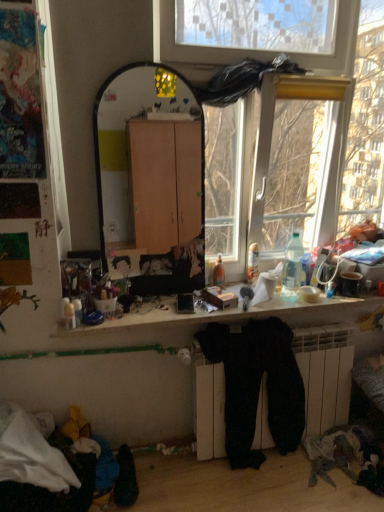
The width and height of the screenshot is (384, 512). Describe the element at coordinates (240, 314) in the screenshot. I see `wooden desk at center` at that location.

The height and width of the screenshot is (512, 384). What do you see at coordinates (257, 385) in the screenshot?
I see `black velvet pants at lower center` at bounding box center [257, 385].

What is the approximate height of clear plastic bottle at right?

The height of clear plastic bottle at right is 13.28 inches.

Locate an element on the screen. wooden desk at center is located at coordinates (240, 314).

From the image's perspective, which one is positioned lower, clear plastic bottle at right or wooden desk at center?

wooden desk at center is shown below in the image.

Between clear plastic bottle at right and wooden desk at center, which one has smaller width?

clear plastic bottle at right.

Is point (299, 279) less distant than point (148, 317)?

That is False.

Considering the relative positions of clear plastic bottle at right and wooden desk at center in the image provided, is clear plastic bottle at right in front of wooden desk at center?

No.

From the image's perspective, which is above, smooth plastic figurine at center, which ranks as the second person in right-to-left order, or silky black fabric at center, the 2th person in the left-to-right sequence?

smooth plastic figurine at center, which ranks as the second person in right-to-left order, from the image's perspective.

Is smooth plastic figurine at center, which ranks as the second person in right-to-left order, wider than silky black fabric at center, which is the first person in right-to-left order?

Yes, smooth plastic figurine at center, which ranks as the second person in right-to-left order, is wider than silky black fabric at center, which is the first person in right-to-left order.

Which object is positioned more to the left, wooden desk at center or silky black fabric at center, the 2th person in the left-to-right sequence?

silky black fabric at center, the 2th person in the left-to-right sequence, is more to the left.

How far apart are wooden desk at center and silky black fabric at center, the 2th person in the left-to-right sequence?

wooden desk at center is 15.70 inches away from silky black fabric at center, the 2th person in the left-to-right sequence.

Locate an element on the screen. computer desk located underneath the silky black fabric at center, which is the first person in right-to-left order (from a real-world perspective) is located at coordinates [x=240, y=314].

Is wooden desk at center positioned with its back to silky black fabric at center, which is the first person in right-to-left order?

That's not correct — wooden desk at center is not looking away from silky black fabric at center, which is the first person in right-to-left order.

In the image, is smooth plastic figurine at center, which ranks as the second person in right-to-left order, positioned in front of or behind clear plastic bottle at right?

In the image, smooth plastic figurine at center, which ranks as the second person in right-to-left order, appears behind clear plastic bottle at right.

Between smooth plastic figurine at center, which ranks as the second person in right-to-left order, and clear plastic bottle at right, which one has smaller size?

Smaller between the two is smooth plastic figurine at center, which ranks as the second person in right-to-left order.

Can you tell me how much smooth plastic figurine at center, which is counted as the 1th person, starting from the left, and clear plastic bottle at right differ in facing direction?

There is a 6.5-degree angle between the facing directions of smooth plastic figurine at center, which is counted as the 1th person, starting from the left, and clear plastic bottle at right.

In the scene shown: Is smooth plastic figurine at center, which is counted as the 1th person, starting from the left, completely or partially outside of clear plastic bottle at right?

Yes, smooth plastic figurine at center, which is counted as the 1th person, starting from the left, is outside of clear plastic bottle at right.

Is clear plastic bottle at right positioned beyond the bounds of smooth plastic figurine at center, which ranks as the second person in right-to-left order?

Yes, clear plastic bottle at right is located beyond the bounds of smooth plastic figurine at center, which ranks as the second person in right-to-left order.

Which is more to the left, clear plastic bottle at right or smooth plastic figurine at center, which ranks as the second person in right-to-left order?

From the viewer's perspective, smooth plastic figurine at center, which ranks as the second person in right-to-left order, appears more on the left side.

Can you tell me how much clear plastic bottle at right and smooth plastic figurine at center, which ranks as the second person in right-to-left order, differ in facing direction?

The angle between the facing direction of clear plastic bottle at right and the facing direction of smooth plastic figurine at center, which ranks as the second person in right-to-left order, is 6.5 degrees.

Can you confirm if clear plastic bottle at right is thinner than smooth plastic figurine at center, which is counted as the 1th person, starting from the left?

Incorrect, the width of clear plastic bottle at right is not less than that of smooth plastic figurine at center, which is counted as the 1th person, starting from the left.

Looking at their sizes, would you say black velvet pants at lower center is wider or thinner than clear plastic bottle at right?

Considering their sizes, black velvet pants at lower center looks broader than clear plastic bottle at right.

Is there a large distance between black velvet pants at lower center and clear plastic bottle at right?

No.

How different are the orientations of black velvet pants at lower center and clear plastic bottle at right in degrees?

The angle between the facing direction of black velvet pants at lower center and the facing direction of clear plastic bottle at right is 1.23 degrees.

Is black velvet pants at lower center turned away from clear plastic bottle at right?

No, clear plastic bottle at right is not at the back of black velvet pants at lower center.

Which is more to the right, black velvet pants at lower center or smooth plastic figurine at center, which is counted as the 1th person, starting from the left?

From the viewer's perspective, black velvet pants at lower center appears more on the right side.

Is black velvet pants at lower center oriented away from smooth plastic figurine at center, which ranks as the second person in right-to-left order?

No, smooth plastic figurine at center, which ranks as the second person in right-to-left order, is not at the back of black velvet pants at lower center.

Locate an element on the screen. clothing on the right of smooth plastic figurine at center, which ranks as the second person in right-to-left order is located at coordinates (257, 385).

Measure the distance from black velvet pants at lower center to smooth plastic figurine at center, which ranks as the second person in right-to-left order.

29.02 inches.

What are the coordinates of `computer desk directly beneath the clear plastic bottle at right (from a real-world perspective)` in the screenshot? It's located at (240, 314).

Identify the location of person on the left of the silky black fabric at center, the 2th person in the left-to-right sequence. This screenshot has height=512, width=384. (123, 266).

Looking at the image, which one is located closer to black velvet pants at lower center, wooden desk at center or silky black fabric at center, which is the first person in right-to-left order?

wooden desk at center lies closer to black velvet pants at lower center than the other object.

From the image, which object appears to be nearer to silky black fabric at center, which is the first person in right-to-left order, wooden desk at center or clear plastic bottle at right?

The object closer to silky black fabric at center, which is the first person in right-to-left order, is wooden desk at center.

Which object lies further to the anchor point clear plastic bottle at right, black velvet pants at lower center or wooden desk at center?

black velvet pants at lower center is positioned further to the anchor clear plastic bottle at right.

From the picture: Considering their positions, is wooden desk at center positioned further to clear plastic bottle at right than smooth plastic figurine at center, which is counted as the 1th person, starting from the left?

smooth plastic figurine at center, which is counted as the 1th person, starting from the left, is positioned further to the anchor clear plastic bottle at right.

Based on their spatial positions, is smooth plastic figurine at center, which ranks as the second person in right-to-left order, or black velvet pants at lower center further from silky black fabric at center, the 2th person in the left-to-right sequence?

black velvet pants at lower center lies further to silky black fabric at center, the 2th person in the left-to-right sequence, than the other object.

When comparing their distances from smooth plastic figurine at center, which is counted as the 1th person, starting from the left, does silky black fabric at center, the 2th person in the left-to-right sequence, or clear plastic bottle at right seem further?

clear plastic bottle at right.

Which object lies nearer to the anchor point clear plastic bottle at right, silky black fabric at center, which is the first person in right-to-left order, or black velvet pants at lower center?

The object closer to clear plastic bottle at right is black velvet pants at lower center.

Based on their spatial positions, is smooth plastic figurine at center, which is counted as the 1th person, starting from the left, or clear plastic bottle at right closer to wooden desk at center?

clear plastic bottle at right.

Locate an element on the screen. Image resolution: width=384 pixels, height=512 pixels. person situated between smooth plastic figurine at center, which ranks as the second person in right-to-left order, and wooden desk at center from left to right is located at coordinates (156, 264).

Find the location of a particular element. computer desk between silky black fabric at center, the 2th person in the left-to-right sequence, and black velvet pants at lower center, in the vertical direction is located at coordinates (240, 314).

The width and height of the screenshot is (384, 512). Identify the location of person between smooth plastic figurine at center, which is counted as the 1th person, starting from the left, and black velvet pants at lower center from top to bottom. click(x=156, y=264).

The height and width of the screenshot is (512, 384). In order to click on computer desk between smooth plastic figurine at center, which is counted as the 1th person, starting from the left, and black velvet pants at lower center in this screenshot , I will do coord(240,314).